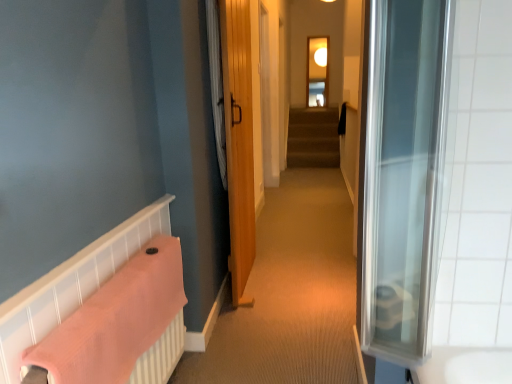
Question: Is the position of transparent glass window at upper center more distant than that of white fabric shower curtain at center?

Choices:
 (A) yes
 (B) no

Answer: (A)

Question: Is transparent glass window at upper center not within white fabric shower curtain at center?

Choices:
 (A) no
 (B) yes

Answer: (B)

Question: Is white fabric shower curtain at center located within transparent glass window at upper center?

Choices:
 (A) no
 (B) yes

Answer: (A)

Question: Is transparent glass window at upper center oriented towards white fabric shower curtain at center?

Choices:
 (A) no
 (B) yes

Answer: (B)

Question: Can you confirm if transparent glass window at upper center is taller than white fabric shower curtain at center?

Choices:
 (A) no
 (B) yes

Answer: (B)

Question: Considering the relative sizes of transparent glass window at upper center and white fabric shower curtain at center in the image provided, is transparent glass window at upper center bigger than white fabric shower curtain at center?

Choices:
 (A) no
 (B) yes

Answer: (B)

Question: Are pink fabric towel at lower left and white fabric shower curtain at center far apart?

Choices:
 (A) no
 (B) yes

Answer: (B)

Question: Is pink fabric towel at lower left completely or partially outside of white fabric shower curtain at center?

Choices:
 (A) yes
 (B) no

Answer: (A)

Question: From a real-world perspective, is pink fabric towel at lower left physically below white fabric shower curtain at center?

Choices:
 (A) no
 (B) yes

Answer: (B)

Question: Is pink fabric towel at lower left bigger than white fabric shower curtain at center?

Choices:
 (A) yes
 (B) no

Answer: (A)

Question: Considering the relative sizes of pink fabric towel at lower left and white fabric shower curtain at center in the image provided, is pink fabric towel at lower left taller than white fabric shower curtain at center?

Choices:
 (A) no
 (B) yes

Answer: (A)

Question: Does pink fabric towel at lower left have a lesser height compared to white fabric shower curtain at center?

Choices:
 (A) no
 (B) yes

Answer: (B)

Question: Is pink fabric towel at lower left completely or partially outside of transparent glass window at upper center?

Choices:
 (A) yes
 (B) no

Answer: (A)